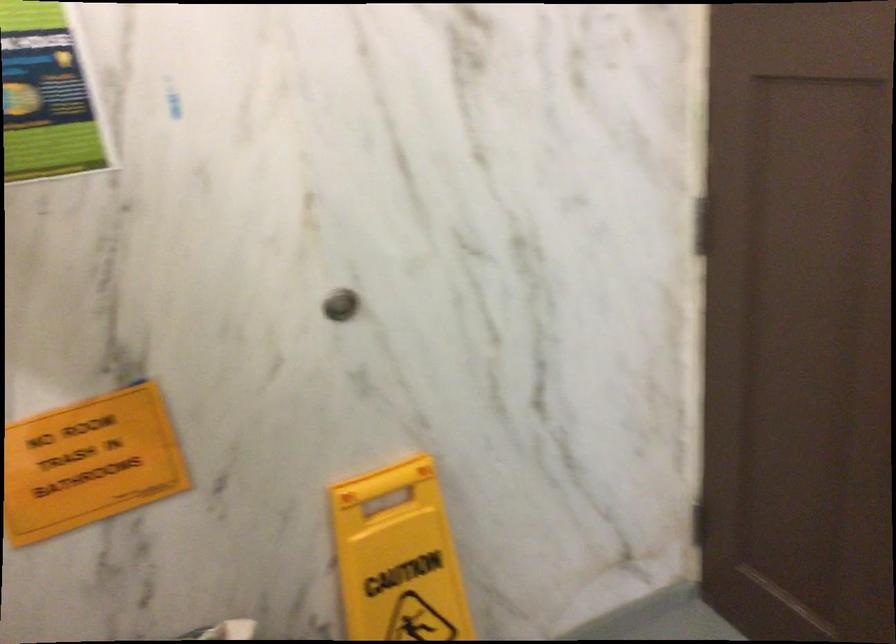
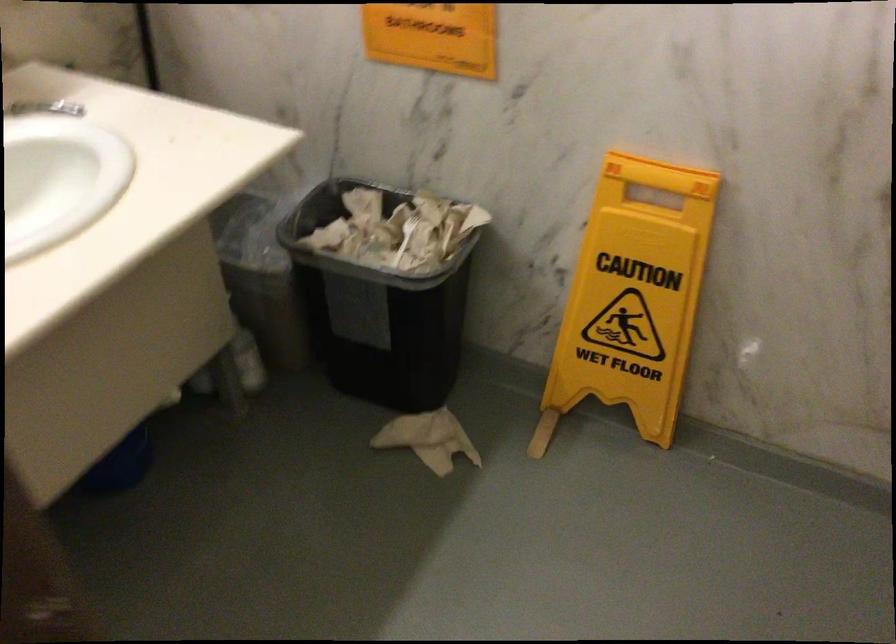
The point at [392,482] is marked in the first image. Where is the corresponding point in the second image?

(659, 175)